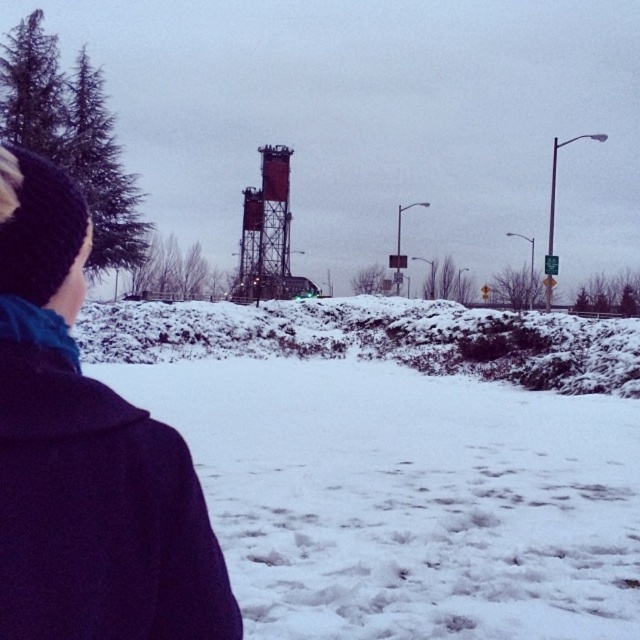
You are standing at the center of the image and want to move towards the dark blue woolen coat at left. Which direction should you face to walk directly towards it?

The dark blue woolen coat at left is located at point (x=96, y=506), so you should face towards the left side of the image to walk directly towards it.